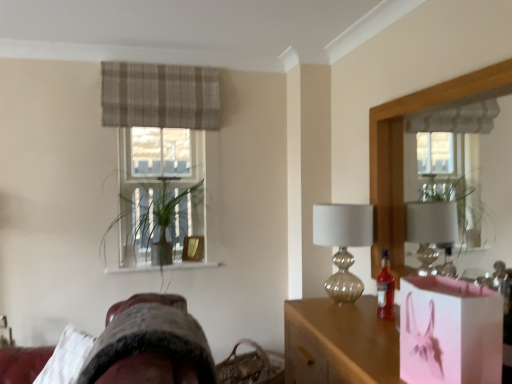
Question: Considering the relative sizes of green leafy plant at center and translucent glass bottle at right in the image provided, is green leafy plant at center thinner than translucent glass bottle at right?

Choices:
 (A) yes
 (B) no

Answer: (B)

Question: Is the position of green leafy plant at center more distant than that of translucent glass bottle at right?

Choices:
 (A) yes
 (B) no

Answer: (A)

Question: Is green leafy plant at center shorter than translucent glass bottle at right?

Choices:
 (A) no
 (B) yes

Answer: (A)

Question: Can you confirm if green leafy plant at center is bigger than translucent glass bottle at right?

Choices:
 (A) no
 (B) yes

Answer: (B)

Question: Is green leafy plant at center not within translucent glass bottle at right?

Choices:
 (A) no
 (B) yes

Answer: (B)

Question: From their relative heights in the image, would you say wooden frame mirror at right is taller or shorter than plaid fabric curtain at upper center?

Choices:
 (A) short
 (B) tall

Answer: (B)

Question: In terms of width, does wooden frame mirror at right look wider or thinner when compared to plaid fabric curtain at upper center?

Choices:
 (A) thin
 (B) wide

Answer: (A)

Question: Does point (441, 107) appear closer or farther from the camera than point (206, 104)?

Choices:
 (A) closer
 (B) farther

Answer: (A)

Question: In terms of size, does wooden frame mirror at right appear bigger or smaller than plaid fabric curtain at upper center?

Choices:
 (A) small
 (B) big

Answer: (B)

Question: Relative to wooden frame mirror at right, is woven brown basket at lower center in front or behind?

Choices:
 (A) behind
 (B) front

Answer: (A)

Question: Is woven brown basket at lower center wider or thinner than wooden frame mirror at right?

Choices:
 (A) wide
 (B) thin

Answer: (A)

Question: Considering the positions of woven brown basket at lower center and wooden frame mirror at right in the image, is woven brown basket at lower center bigger or smaller than wooden frame mirror at right?

Choices:
 (A) big
 (B) small

Answer: (B)

Question: Considering the relative positions of woven brown basket at lower center and wooden frame mirror at right in the image provided, is woven brown basket at lower center to the left or to the right of wooden frame mirror at right?

Choices:
 (A) right
 (B) left

Answer: (B)

Question: Is pink paper bag at lower right situated inside pink glossy bag at center or outside?

Choices:
 (A) inside
 (B) outside

Answer: (B)

Question: Is pink paper bag at lower right in front of or behind pink glossy bag at center in the image?

Choices:
 (A) front
 (B) behind

Answer: (A)